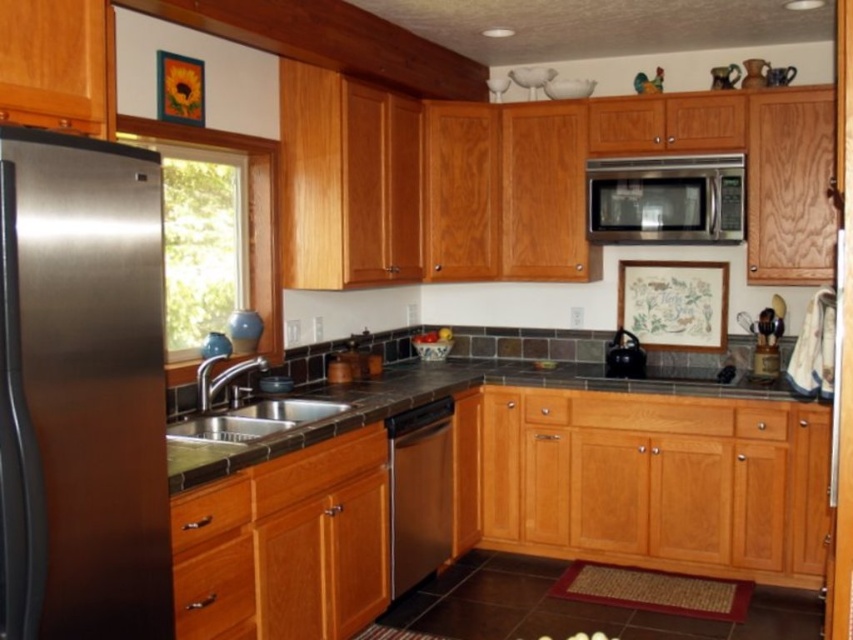
Question: Is satin silver microwave at upper center thinner than stainless steel dishwasher at center?

Choices:
 (A) yes
 (B) no

Answer: (B)

Question: Which object appears farthest from the camera in this image?

Choices:
 (A) stainless steel refrigerator at left
 (B) stainless steel sink at center

Answer: (B)

Question: Among these objects, which one is farthest from the camera?

Choices:
 (A) stainless steel refrigerator at left
 (B) stainless steel sink at center
 (C) dark gray granite countertop at center
 (D) satin silver microwave at upper center

Answer: (D)

Question: Which object is farther from the camera taking this photo?

Choices:
 (A) dark gray granite countertop at center
 (B) stainless steel dishwasher at center
 (C) stainless steel sink at center
 (D) satin silver microwave at upper center

Answer: (D)

Question: Is the position of dark gray granite countertop at center less distant than that of stainless steel dishwasher at center?

Choices:
 (A) no
 (B) yes

Answer: (B)

Question: Observing the image, what is the correct spatial positioning of stainless steel refrigerator at left in reference to dark gray granite countertop at center?

Choices:
 (A) above
 (B) below

Answer: (A)